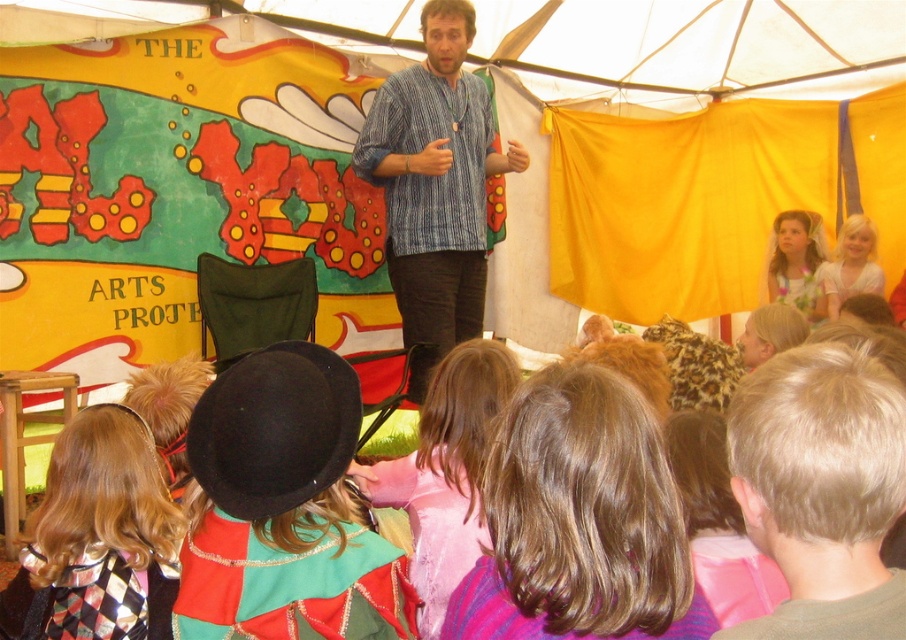
Question: Among these points, which one is nearest to the camera?

Choices:
 (A) (786, 288)
 (B) (664, 307)
 (C) (800, 502)
 (D) (412, 147)

Answer: (C)

Question: Which is farther from the blonde hair at center?

Choices:
 (A) harlequin-patterned scarf at lower left
 (B) light blonde hair at upper right

Answer: (B)

Question: Does pink satin dress at center appear on the left side of light blonde hair at upper right?

Choices:
 (A) yes
 (B) no

Answer: (A)

Question: Which object appears farthest from the camera in this image?

Choices:
 (A) blonde hair at center
 (B) striped cotton shirt at center

Answer: (B)

Question: Does striped cotton shirt at center appear over pink satin dress at center?

Choices:
 (A) yes
 (B) no

Answer: (A)

Question: Is pink satin dress at center in front of floral fabric dress at upper right?

Choices:
 (A) yes
 (B) no

Answer: (A)